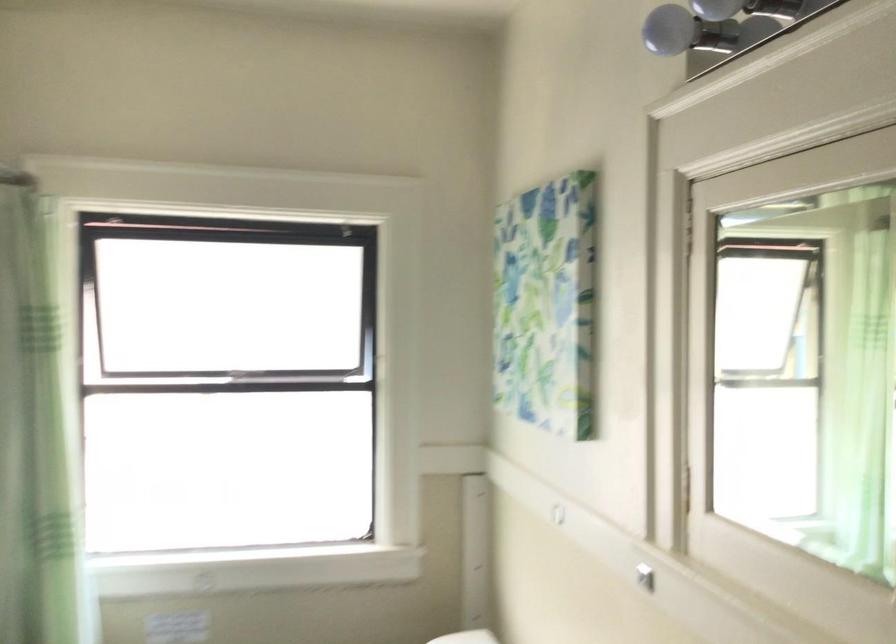
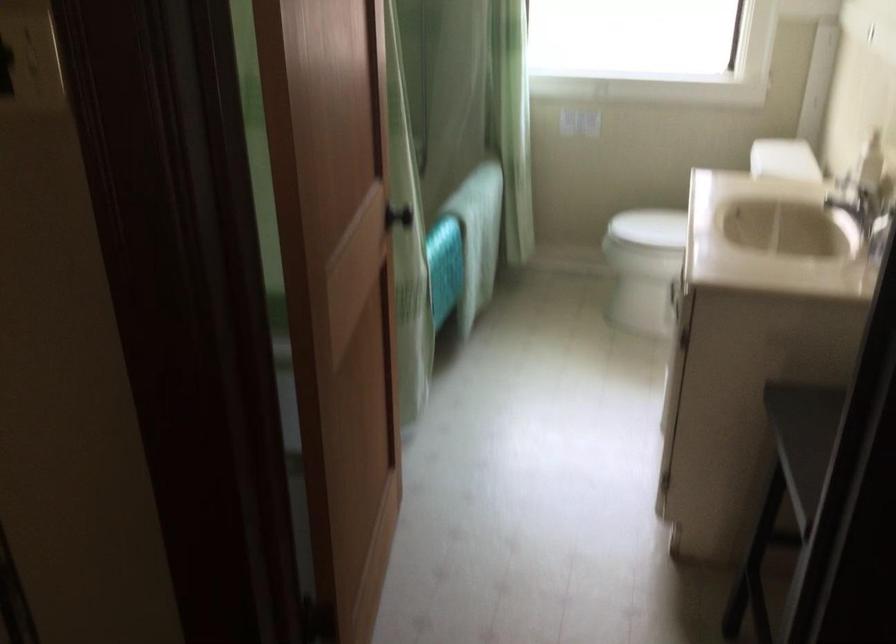
The first image is from the beginning of the video and the second image is from the end. How did the camera likely rotate when shooting the video?

The rotation direction of the camera is left-down.